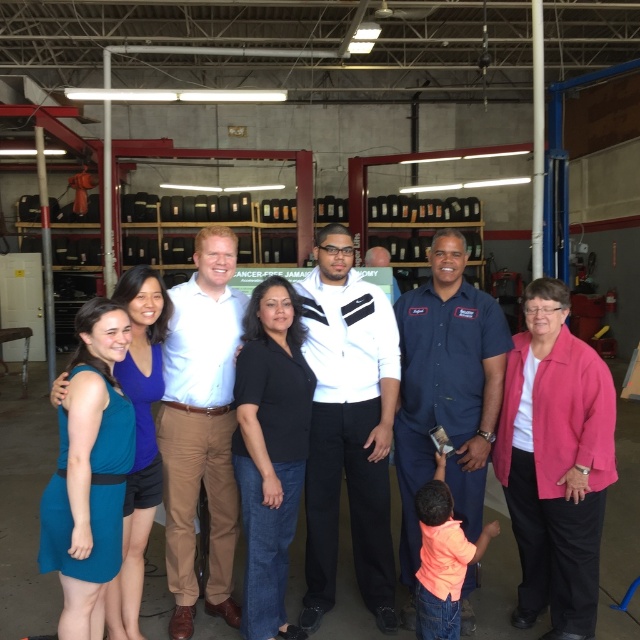
Question: Is blue uniform shirt at center below brown cotton pants at center?

Choices:
 (A) yes
 (B) no

Answer: (B)

Question: Is white smooth jacket at center wider than teal fabric dress at lower left?

Choices:
 (A) yes
 (B) no

Answer: (B)

Question: Which of the following is the farthest from the observer?

Choices:
 (A) blue uniform shirt at center
 (B) white smooth jacket at center
 (C) brown cotton pants at center

Answer: (B)

Question: Which is nearer to the white smooth jacket at center?

Choices:
 (A) blue uniform shirt at center
 (B) brown cotton pants at center

Answer: (A)

Question: Which point is farther from the camera taking this photo?

Choices:
 (A) (465, 499)
 (B) (396, 465)
 (C) (323, 307)
 (D) (188, 321)

Answer: (B)

Question: Can you confirm if brown cotton pants at center is smaller than teal fabric dress at lower left?

Choices:
 (A) no
 (B) yes

Answer: (B)